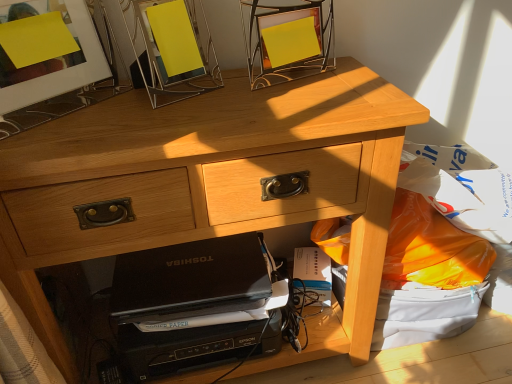
Question: Is white paper at lower center at the right side of metallic silver picture frame at upper center, positioned as the second picture frame in left-to-right order?

Choices:
 (A) yes
 (B) no

Answer: (A)

Question: Can you confirm if white paper at lower center is bigger than metallic silver picture frame at upper center, positioned as the second picture frame in left-to-right order?

Choices:
 (A) yes
 (B) no

Answer: (B)

Question: From a real-world perspective, does white paper at lower center stand above metallic silver picture frame at upper center, marked as the 1th picture frame in a right-to-left arrangement?

Choices:
 (A) yes
 (B) no

Answer: (B)

Question: Can you confirm if white paper at lower center is taller than metallic silver picture frame at upper center, marked as the 1th picture frame in a right-to-left arrangement?

Choices:
 (A) yes
 (B) no

Answer: (B)

Question: From a real-world perspective, does white paper at lower center sit lower than metallic silver picture frame at upper center, marked as the 1th picture frame in a right-to-left arrangement?

Choices:
 (A) no
 (B) yes

Answer: (B)

Question: Looking at their shapes, would you say matte glass picture frame at upper left, the first picture frame in the left-to-right sequence, is wider or thinner than white paper at lower center?

Choices:
 (A) wide
 (B) thin

Answer: (B)

Question: From a real-world perspective, is matte glass picture frame at upper left, the first picture frame in the left-to-right sequence, physically located above or below white paper at lower center?

Choices:
 (A) below
 (B) above

Answer: (B)

Question: Considering the positions of matte glass picture frame at upper left, acting as the 2th picture frame starting from the right, and white paper at lower center in the image, is matte glass picture frame at upper left, acting as the 2th picture frame starting from the right, taller or shorter than white paper at lower center?

Choices:
 (A) tall
 (B) short

Answer: (A)

Question: Is matte glass picture frame at upper left, the first picture frame in the left-to-right sequence, bigger or smaller than white paper at lower center?

Choices:
 (A) big
 (B) small

Answer: (A)

Question: From their relative heights in the image, would you say black matte laptop at lower center is taller or shorter than white paper at lower center?

Choices:
 (A) tall
 (B) short

Answer: (B)

Question: In terms of width, does black matte laptop at lower center look wider or thinner when compared to white paper at lower center?

Choices:
 (A) thin
 (B) wide

Answer: (B)

Question: Considering their positions, is black matte laptop at lower center located in front of or behind white paper at lower center?

Choices:
 (A) front
 (B) behind

Answer: (A)

Question: Is black matte laptop at lower center to the left or to the right of white paper at lower center in the image?

Choices:
 (A) left
 (B) right

Answer: (A)

Question: Looking at the image, does matte glass picture frame at upper left, the first picture frame in the left-to-right sequence, seem bigger or smaller compared to light wood desk at center?

Choices:
 (A) big
 (B) small

Answer: (B)

Question: Which is correct: matte glass picture frame at upper left, the first picture frame in the left-to-right sequence, is inside light wood desk at center, or outside of it?

Choices:
 (A) outside
 (B) inside

Answer: (A)